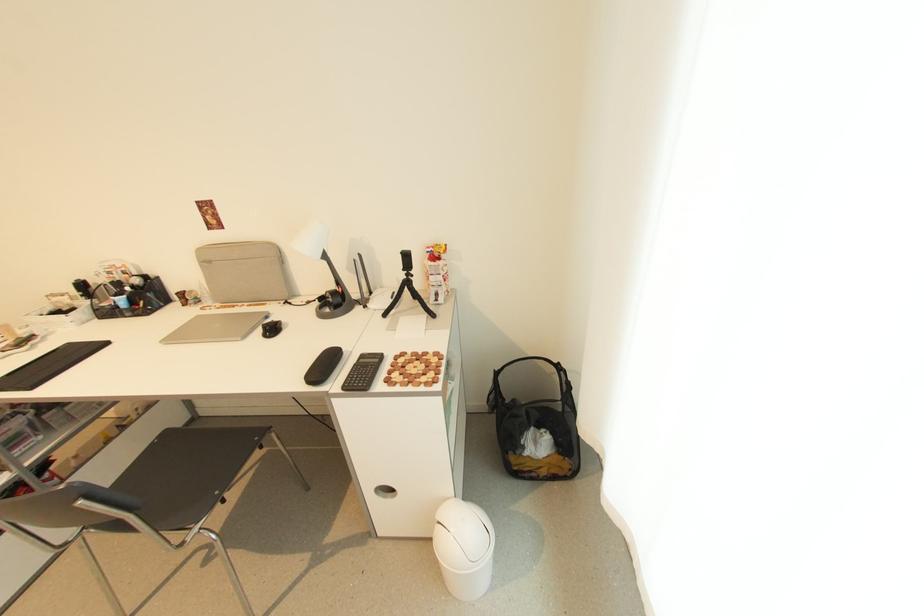
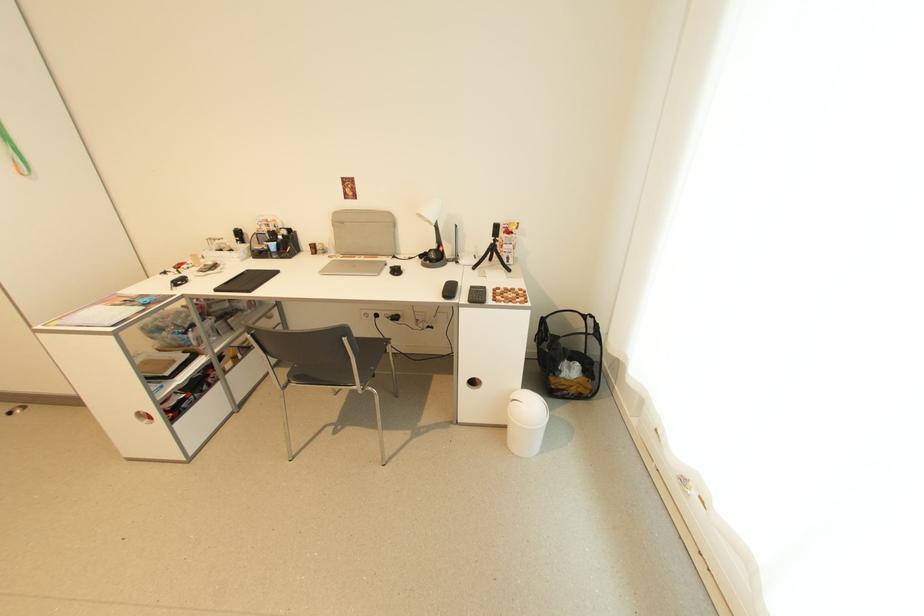
Where in the second image is the point corresponding to (531,455) from the first image?

(566, 377)